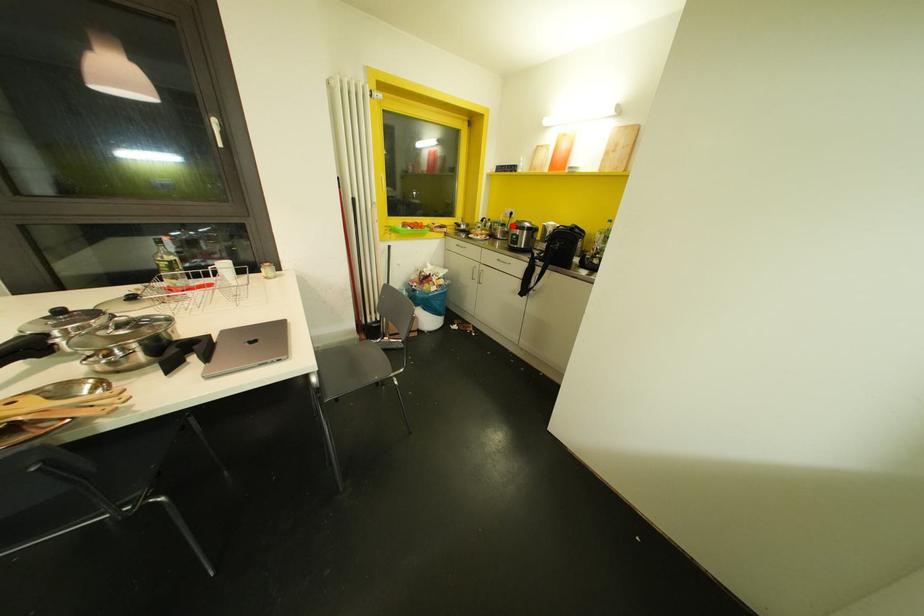
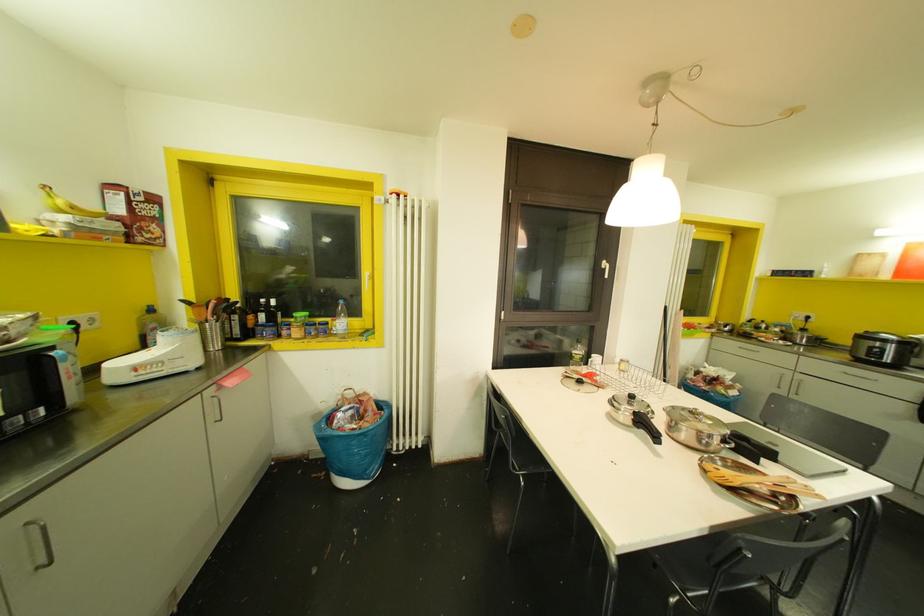
Question: I am providing you with two images of the same scene from different viewpoints. In image1, a red point is highlighted. Considering the same 3D point in image2, which of the following is correct?

Choices:
 (A) It is closer
 (B) It is farther

Answer: (B)